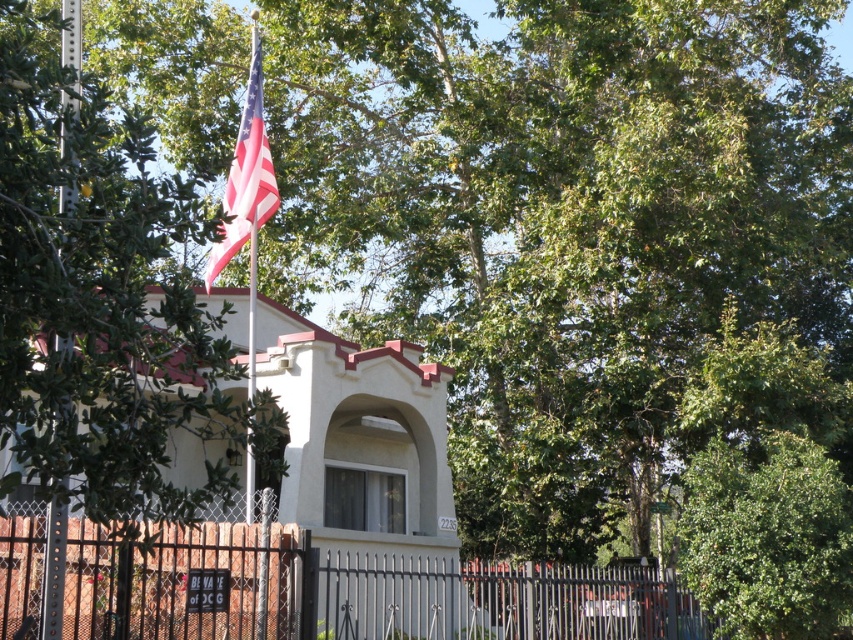
You are a maintenance worker who needs to replace the flag pole. The new flag pole you have is 10 feet tall. The current flag pole is 15 feet tall. The flag must be at least 5 feet above the ground to avoid damage. Considering the distance between the american flag at upper center and the metallic silver flag pole at left, can you safely lower the flag pole to 10 feet without violating the height requirement?

The distance between the american flag at upper center and the metallic silver flag pole at left is 23.21 feet. However, the question about lowering the flag pole to 10 feet relates to the height requirement of keeping the flag at least 5 feet above the ground. Since the new flag pole is 10 feet tall, and the flag must be at least 5 feet above the ground, as long as the base of the flag pole is placed such that the top of the flag remains above 5 feet, it should be safe. The 23.21 feet distance between the

Looking at this image, you are standing in front of the house and notice the american flag at upper center and the metallic silver flag pole at left. Which object is positioned to the left of the other?

The american flag at upper center is to the left of metallic silver flag pole at left, meaning the flag is positioned to the left side of the pole.